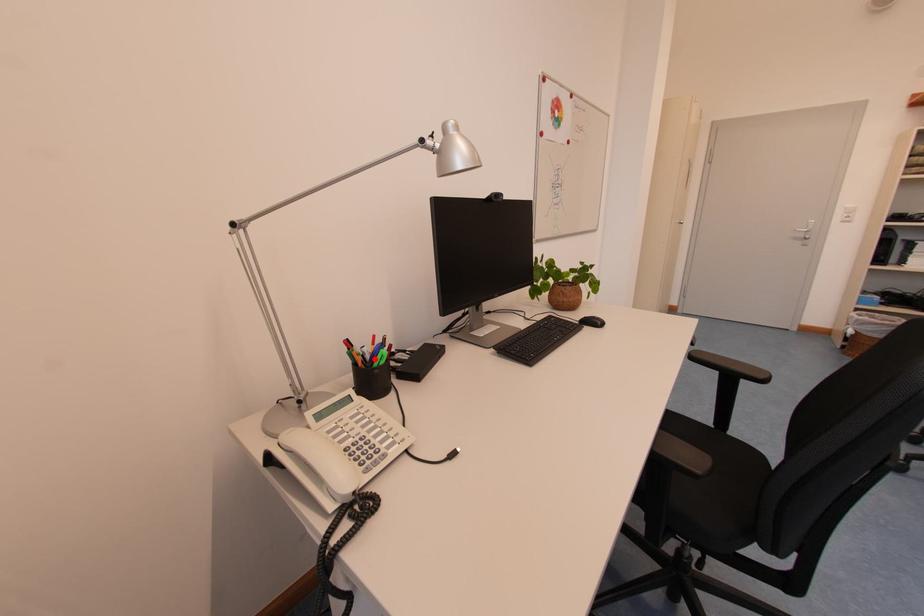
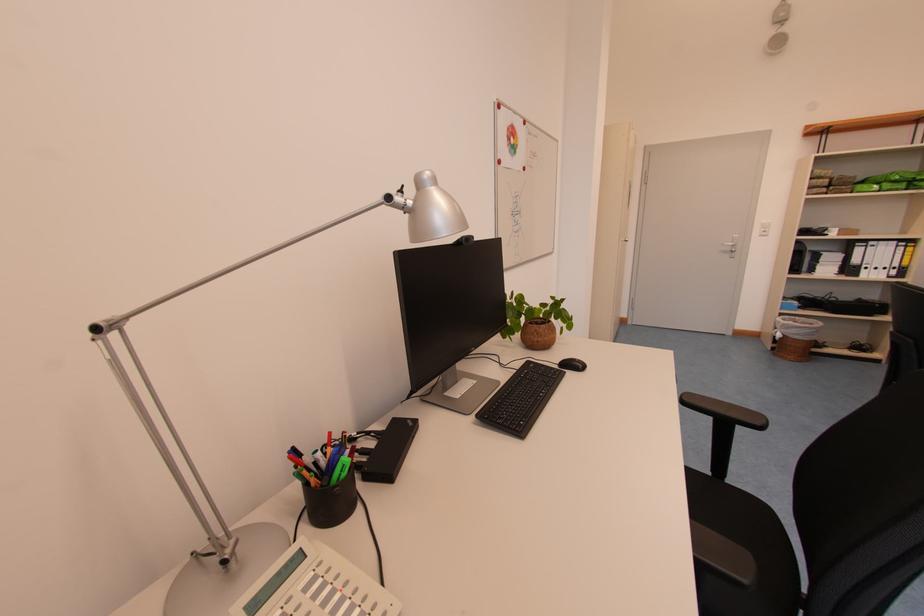
Where in the second image is the point corresponding to the highlighted location from the first image?

(331, 466)